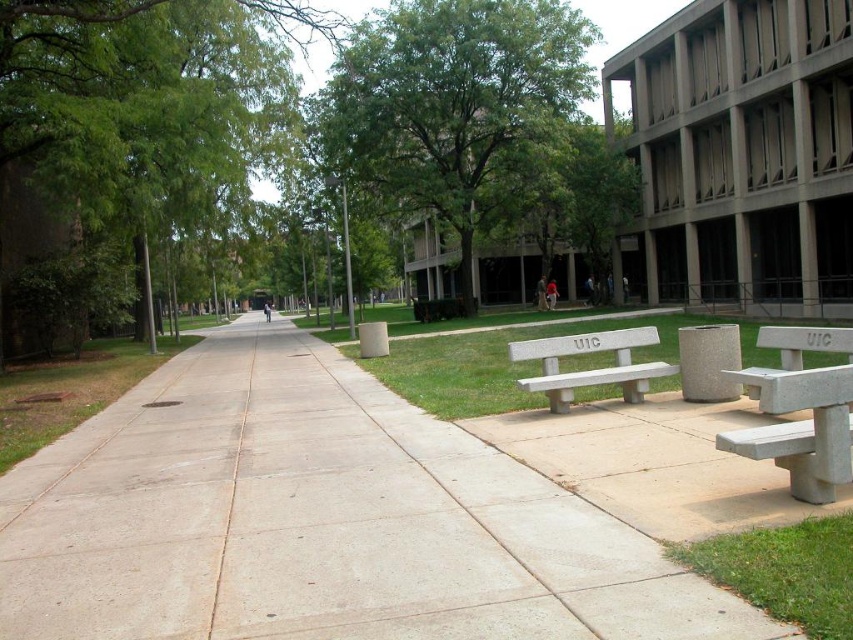
Is green grass at lower right to the left of white concrete bench at center from the viewer's perspective?

Indeed, green grass at lower right is positioned on the left side of white concrete bench at center.

Is green grass at lower right further to camera compared to white concrete bench at center?

No.

The image size is (853, 640). Describe the element at coordinates (784, 570) in the screenshot. I see `green grass at lower right` at that location.

This screenshot has height=640, width=853. I want to click on green grass at lower right, so click(784, 570).

Does gray concrete bench at right appear on the left side of white concrete bench at center?

No, gray concrete bench at right is not to the left of white concrete bench at center.

This screenshot has height=640, width=853. I want to click on gray concrete bench at right, so click(799, 410).

What do you see at coordinates (799, 410) in the screenshot? Image resolution: width=853 pixels, height=640 pixels. I see `gray concrete bench at right` at bounding box center [799, 410].

You are a GUI agent. You are given a task and a screenshot of the screen. Output one action in this format:
    pyautogui.click(x=<x>, y=<y>)
    Task: Click on the gray concrete bench at right
    The height and width of the screenshot is (640, 853).
    Given the screenshot: What is the action you would take?
    pyautogui.click(x=799, y=410)

Does green leafy tree at center have a greater width compared to white concrete bench at center?

Correct, the width of green leafy tree at center exceeds that of white concrete bench at center.

Does point (343, 100) come behind point (596, 340)?

Yes.

Where is `green leafy tree at center`? green leafy tree at center is located at coordinates (456, 106).